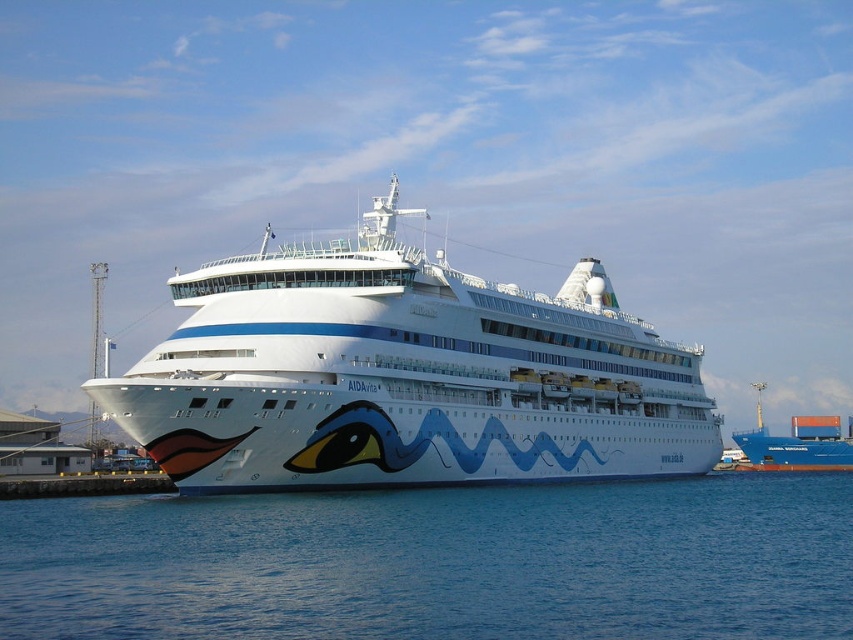
Question: Can you confirm if blue liquid water at lower center is thinner than blue matte cargo ship at center?

Choices:
 (A) no
 (B) yes

Answer: (A)

Question: Which object appears farthest from the camera in this image?

Choices:
 (A) blue liquid water at lower center
 (B) white glossy cruise ship at center
 (C) blue matte cargo ship at center

Answer: (C)

Question: Does white glossy cruise ship at center appear on the left side of blue matte cargo ship at center?

Choices:
 (A) no
 (B) yes

Answer: (B)

Question: Does white glossy cruise ship at center have a lesser width compared to blue matte cargo ship at center?

Choices:
 (A) yes
 (B) no

Answer: (B)

Question: Which point is closer to the camera taking this photo?

Choices:
 (A) (219, 394)
 (B) (440, 604)
 (C) (822, 461)

Answer: (B)

Question: Which of the following is the closest to the observer?

Choices:
 (A) blue matte cargo ship at center
 (B) blue liquid water at lower center
 (C) white glossy cruise ship at center

Answer: (B)